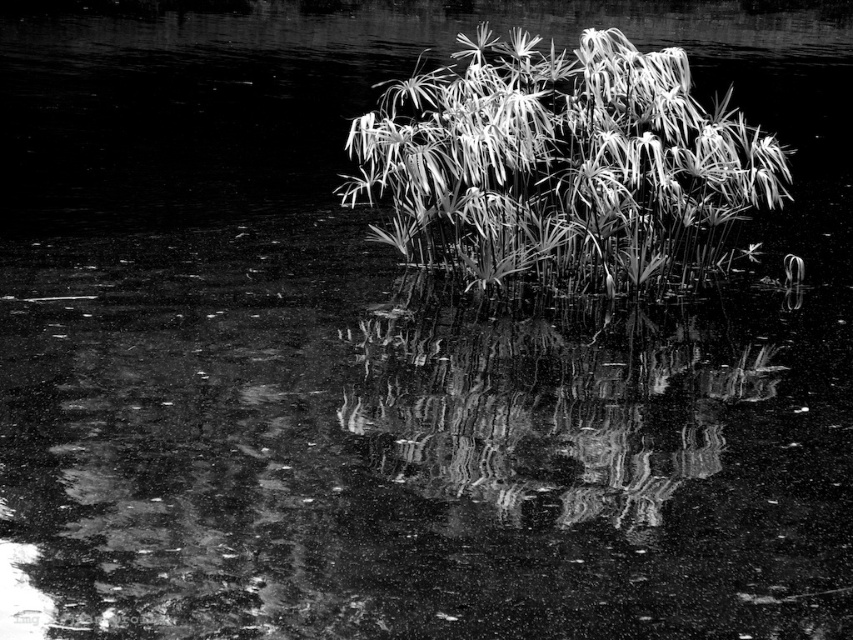
Does silvery metallic plant at center come behind smooth reflective water at center?

Yes, silvery metallic plant at center is behind smooth reflective water at center.

Does silvery metallic plant at center have a smaller size compared to smooth reflective water at center?

Correct, silvery metallic plant at center occupies less space than smooth reflective water at center.

I want to click on silvery metallic plant at center, so click(561, 166).